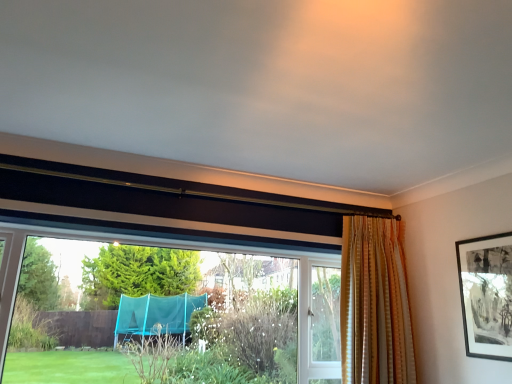
Question: Considering their positions, is black matte picture frame at upper right located in front of or behind striped fabric curtain at right?

Choices:
 (A) behind
 (B) front

Answer: (B)

Question: Which is correct: black matte picture frame at upper right is inside striped fabric curtain at right, or outside of it?

Choices:
 (A) outside
 (B) inside

Answer: (A)

Question: Which is farther from the transparent plastic trampoline at lower left?

Choices:
 (A) striped fabric curtain at right
 (B) black matte picture frame at upper right

Answer: (B)

Question: Which object is positioned closest to the striped fabric curtain at right?

Choices:
 (A) black matte picture frame at upper right
 (B) transparent plastic trampoline at lower left

Answer: (A)